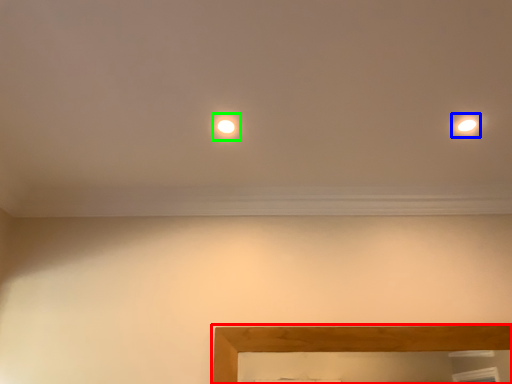
Question: Which object is the closest to the picture frame (highlighted by a red box)? Choose among these: light (highlighted by a blue box) or glow (highlighted by a green box).

Choices:
 (A) light
 (B) glow

Answer: (A)